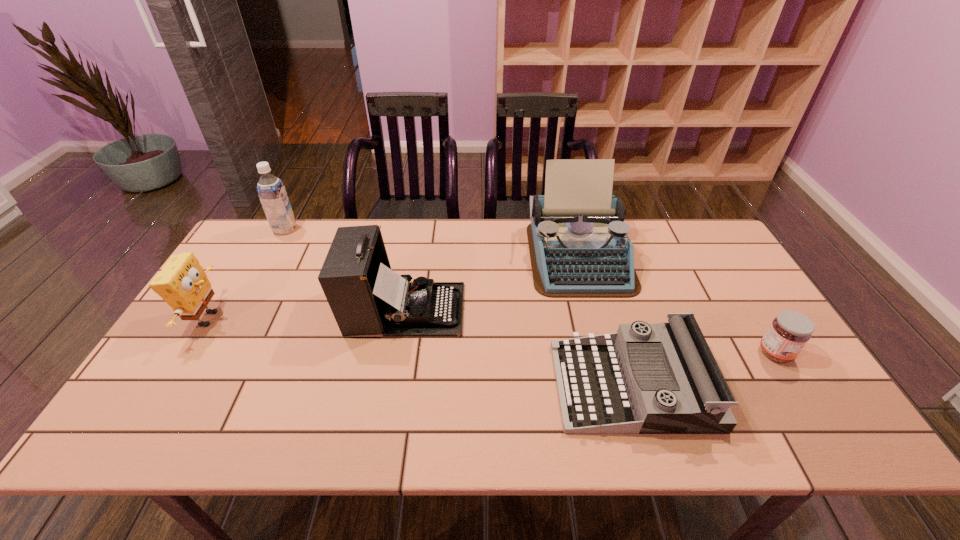
You are a GUI agent. You are given a task and a screenshot of the screen. Output one action in this format:
    pyautogui.click(x=<x>, y=<y>)
    Task: Click on the fifth closest object to the jam
    This screenshot has width=960, height=540.
    Given the screenshot: What is the action you would take?
    (271, 191)

Choose which typewriter is the third nearest neighbor to the soya milk. Please provide its 2D coordinates. Your answer should be formatted as a tuple, i.e. [(x, y)], where the tuple contains the x and y coordinates of a point satisfying the conditions above.

[(662, 378)]

You are a GUI agent. You are given a task and a screenshot of the screen. Output one action in this format:
    pyautogui.click(x=<x>, y=<y>)
    Task: Click on the closest typewriter to the third shortest object
    The width and height of the screenshot is (960, 540).
    Given the screenshot: What is the action you would take?
    pyautogui.click(x=366, y=297)